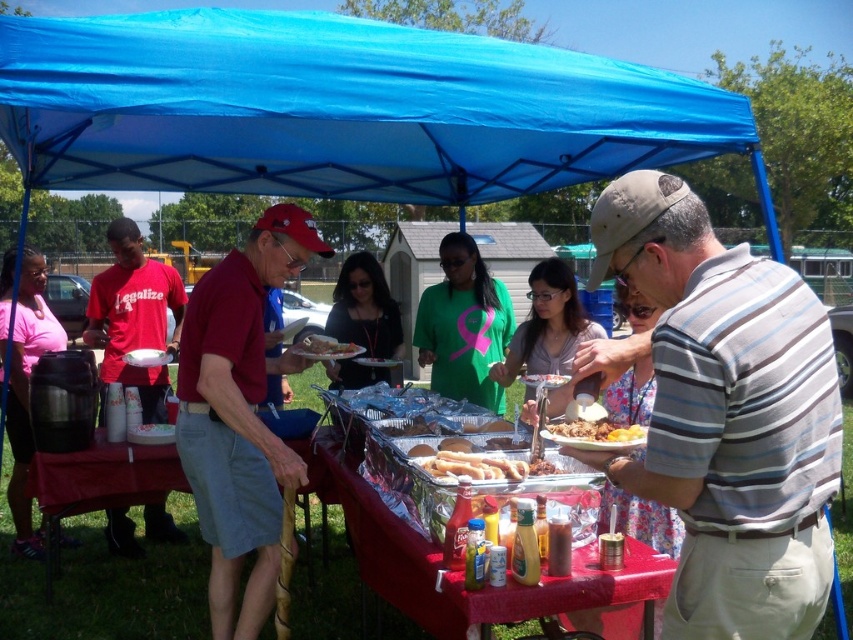
Question: Which point is farther from the camera taking this photo?

Choices:
 (A) (321, 340)
 (B) (306, 547)
 (C) (50, 333)

Answer: (C)

Question: Is matte red t-shirt at left bigger than brown bread at center?

Choices:
 (A) yes
 (B) no

Answer: (A)

Question: Which object is positioned farthest from the golden fried dough at center?

Choices:
 (A) matte red t-shirt at left
 (B) green matte shirt at center
 (C) metallic silver tray at center
 (D) slightly toasted bread at center

Answer: (A)

Question: Does green matte shirt at center appear on the right side of golden fried dough at center?

Choices:
 (A) yes
 (B) no

Answer: (A)

Question: Which of the following is the farthest from the observer?

Choices:
 (A) (30, 506)
 (B) (509, 440)
 (C) (556, 426)
 (D) (218, 364)

Answer: (A)

Question: Can you confirm if gray striped shirt at center is thinner than golden crispy chicken at center?

Choices:
 (A) yes
 (B) no

Answer: (B)